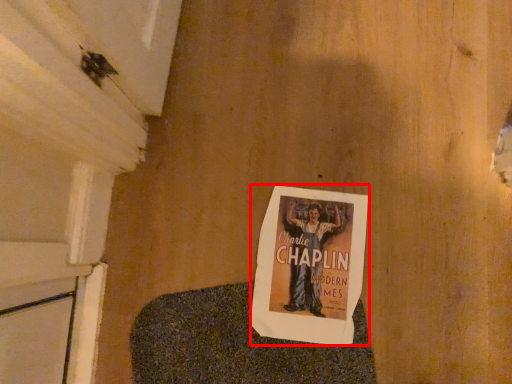
Question: Considering the relative positions of poster (annotated by the red box) and blanket in the image provided, where is poster (annotated by the red box) located with respect to the staircase?

Choices:
 (A) right
 (B) left

Answer: (A)